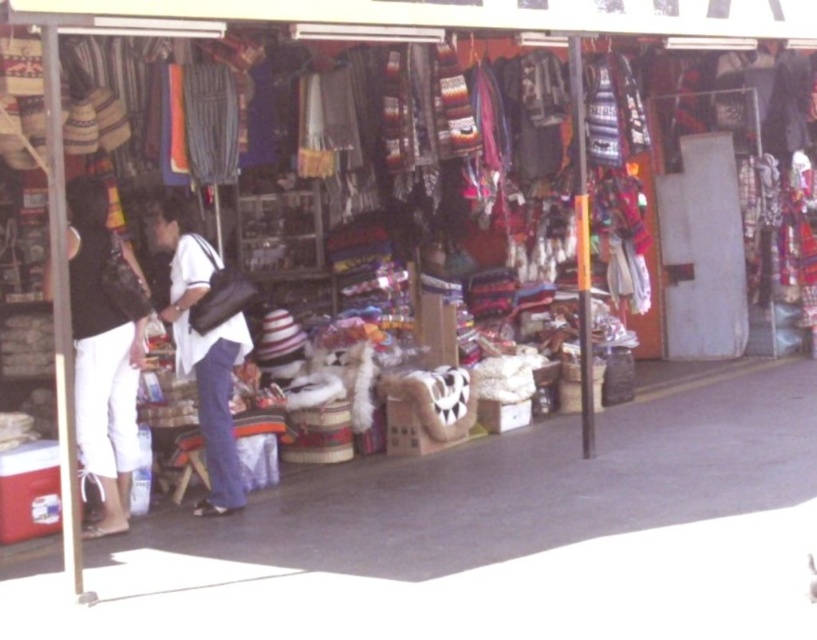
Is white cotton pants at left positioned behind white matte shirt at center?

No, white cotton pants at left is closer to the viewer.

Who is more distant from viewer, (126, 332) or (219, 436)?

The point (219, 436) is more distant.

Image resolution: width=817 pixels, height=640 pixels. What do you see at coordinates (101, 353) in the screenshot?
I see `white cotton pants at left` at bounding box center [101, 353].

This screenshot has width=817, height=640. I want to click on white cotton pants at left, so click(101, 353).